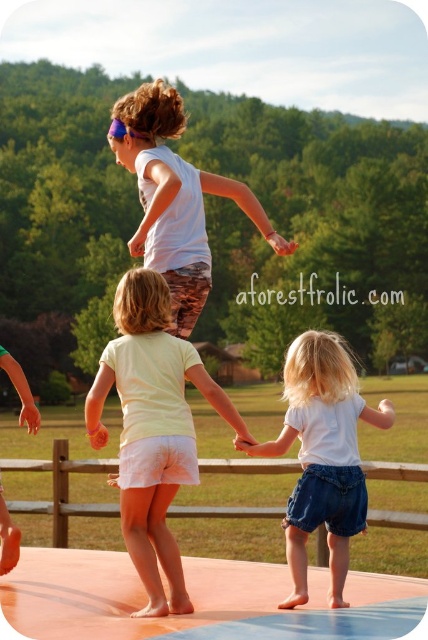
Does white cotton shirt at center appear on the right side of white matte shirt at upper center?

Yes, white cotton shirt at center is to the right of white matte shirt at upper center.

Is white cotton shirt at center positioned in front of white matte shirt at upper center?

Yes, it is.

What do you see at coordinates (323, 456) in the screenshot? The image size is (428, 640). I see `white cotton shirt at center` at bounding box center [323, 456].

Locate an element on the screen. The width and height of the screenshot is (428, 640). white cotton shirt at center is located at coordinates click(323, 456).

Can you confirm if yellow cotton shirt at center is smaller than white cotton shirt at center?

No.

Which is more to the right, yellow cotton shirt at center or white cotton shirt at center?

white cotton shirt at center is more to the right.

Looking at this image, who is more distant from viewer, (177, 576) or (323, 442)?

Positioned behind is point (323, 442).

What are the coordinates of `yellow cotton shirt at center` in the screenshot? It's located at (152, 428).

Does yellow cotton shirt at center have a larger size compared to white matte shirt at upper center?

Incorrect, yellow cotton shirt at center is not larger than white matte shirt at upper center.

Locate an element on the screen. The image size is (428, 640). yellow cotton shirt at center is located at coordinates (152, 428).

At what (x,y) coordinates should I click in order to perform the action: click on yellow cotton shirt at center. Please return your answer as a coordinate pair (x, y). Looking at the image, I should click on (152, 428).